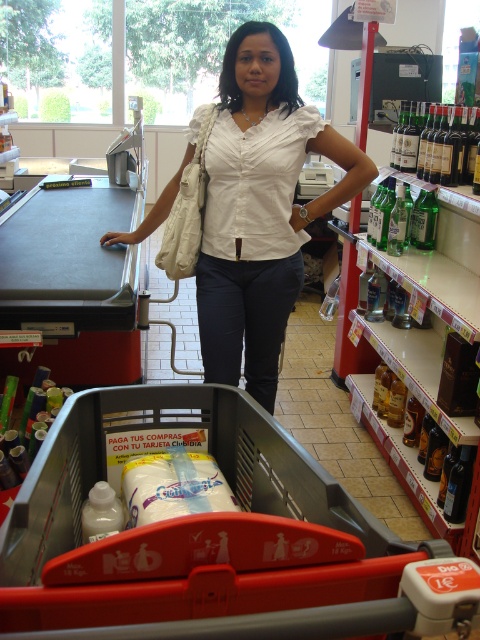
Does red plastic shopping cart at center appear under green glass bottles at upper right?

Correct, red plastic shopping cart at center is located below green glass bottles at upper right.

Does red plastic shopping cart at center come in front of green glass bottles at upper right?

Yes, it is in front of green glass bottles at upper right.

You are a GUI agent. You are given a task and a screenshot of the screen. Output one action in this format:
    pyautogui.click(x=<x>, y=<y>)
    Task: Click on the red plastic shopping cart at center
    This screenshot has width=480, height=640.
    Given the screenshot: What is the action you would take?
    pyautogui.click(x=213, y=538)

Find the location of `red plastic shopping cart at center`. red plastic shopping cart at center is located at coordinates (213, 538).

Is red plastic shopping cart at center taller than green glass bottles at right?

No, red plastic shopping cart at center is not taller than green glass bottles at right.

Is point (48, 593) closer to viewer compared to point (408, 205)?

Yes, it is.

Is point (429, 624) less distant than point (375, 234)?

Yes, it is in front of point (375, 234).

Image resolution: width=480 pixels, height=640 pixels. What are the coordinates of `red plastic shopping cart at center` in the screenshot? It's located at (213, 538).

Between point (436, 205) and point (436, 176), which one is positioned in front?

Point (436, 176) is in front.

Between point (424, 243) and point (456, 156), which one is positioned behind?

The point (424, 243) is behind.

Where is `green glass bottles at right`? green glass bottles at right is located at coordinates (408, 221).